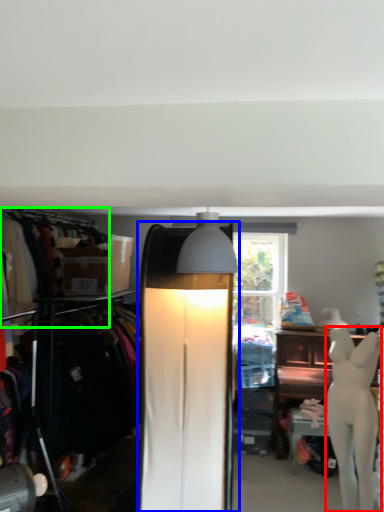
Question: Considering the real-world distances, which object is farthest from mannequin (highlighted by a red box)? lamp (highlighted by a blue box) or clothing (highlighted by a green box)?

Choices:
 (A) lamp
 (B) clothing

Answer: (B)